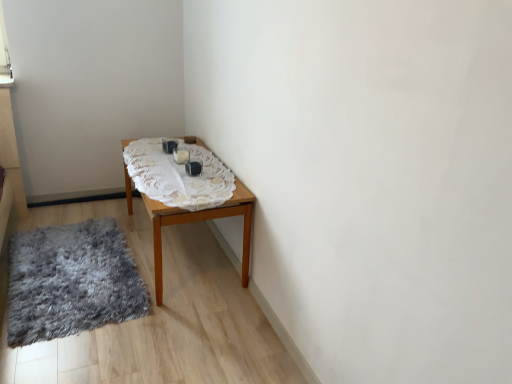
This screenshot has height=384, width=512. What are the coordinates of `space that is in front of wooden table at center` in the screenshot? It's located at (169, 336).